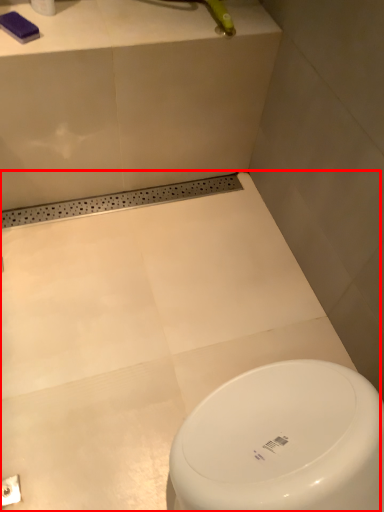
Question: Considering the relative positions of bath (annotated by the red box) and toilet paper in the image provided, where is bath (annotated by the red box) located with respect to the staircase?

Choices:
 (A) right
 (B) left

Answer: (A)